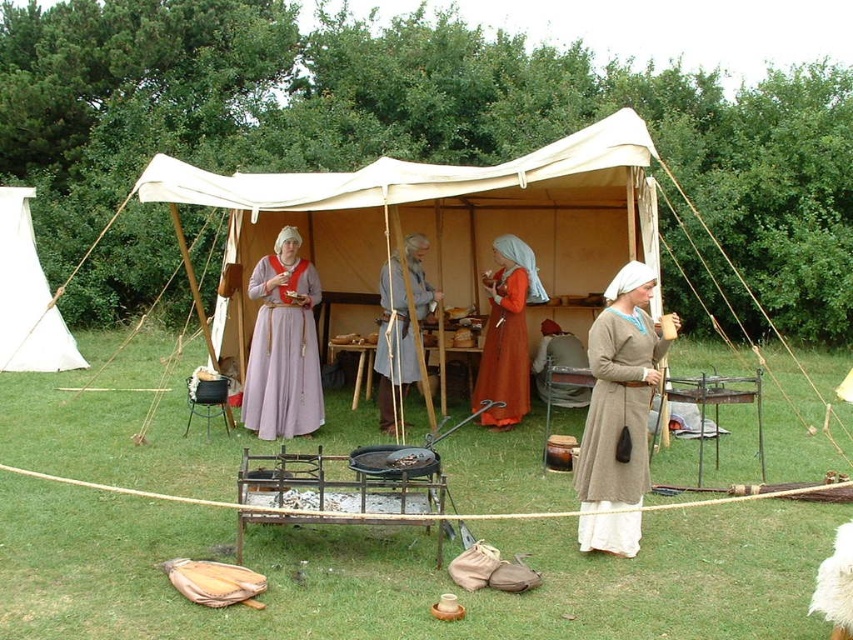
Question: Does white canvas tent at left lie behind orange velvet dress at center?

Choices:
 (A) yes
 (B) no

Answer: (A)

Question: Which object is the closest to the orange velvet dress at center?

Choices:
 (A) brown leather apron at center
 (B) brown woolen dress at center

Answer: (A)

Question: Does matte purple gown at center have a larger size compared to white canvas tent at left?

Choices:
 (A) no
 (B) yes

Answer: (A)

Question: Does white canvas tent at left appear over orange velvet dress at center?

Choices:
 (A) no
 (B) yes

Answer: (B)

Question: Which object appears closest to the camera in this image?

Choices:
 (A) orange velvet dress at center
 (B) white canvas tent at left
 (C) brown woolen dress at center
 (D) brown leather apron at center

Answer: (C)

Question: Estimate the real-world distances between objects in this image. Which object is closer to the matte purple gown at center?

Choices:
 (A) brown leather apron at center
 (B) white canvas tent at left
 (C) orange velvet dress at center
 (D) brown woolen dress at center

Answer: (A)